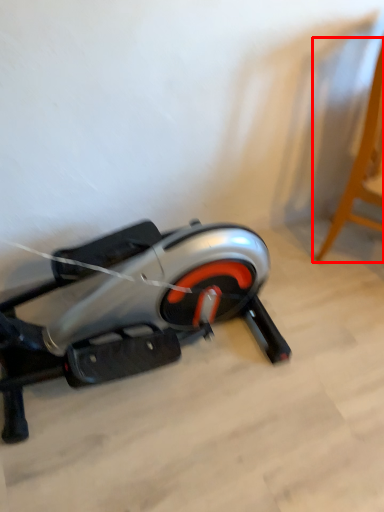
Question: From the image's perspective, where is furniture (annotated by the red box) located in relation to stationary bicycle in the image?

Choices:
 (A) above
 (B) below

Answer: (A)